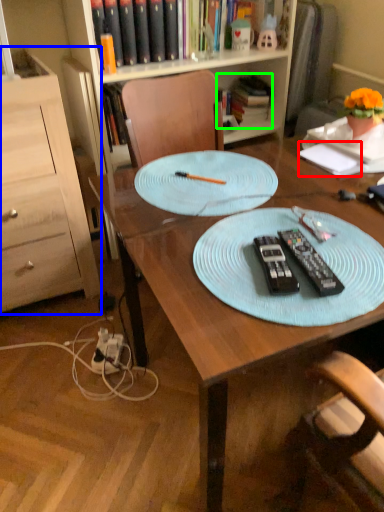
Question: Considering the real-world distances, which object is closest to notepad (highlighted by a red box)? cabinetry (highlighted by a blue box) or book (highlighted by a green box).

Choices:
 (A) cabinetry
 (B) book

Answer: (B)